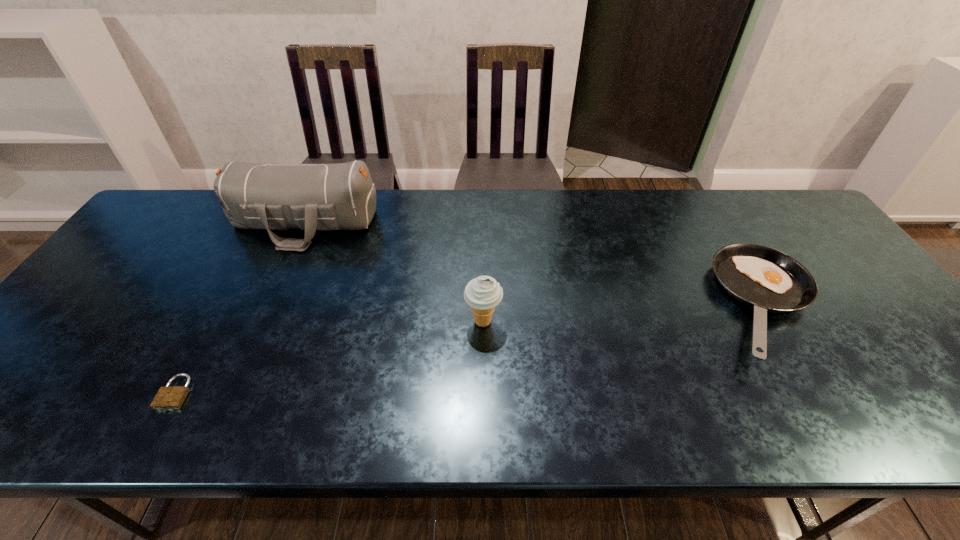
The width and height of the screenshot is (960, 540). Identify the location of free space in the image that satisfies the following two spatial constraints: 1. on the back side of the second object from right to left; 2. on the left side of the frying pan. (483, 306).

Locate an element on the screen. free spot that satisfies the following two spatial constraints: 1. on the front side of the duffel bag; 2. on the right side of the rightmost object is located at coordinates (267, 306).